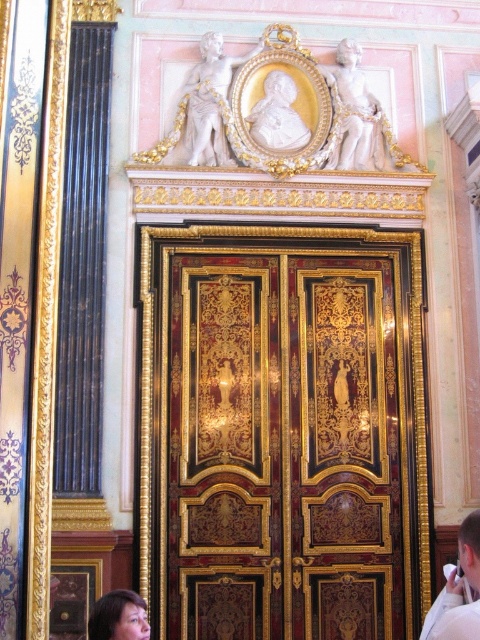
Question: Which point is closer to the camera?

Choices:
 (A) white matte shirt at lower right
 (B) glossy wood door at center
 (C) smooth skin face at lower left
 (D) white satin robe at center

Answer: (D)

Question: Is white matte shirt at lower right to the left of white satin robe at center from the viewer's perspective?

Choices:
 (A) no
 (B) yes

Answer: (A)

Question: Which of the following is the closest to the observer?

Choices:
 (A) glossy wood door at center
 (B) white matte shirt at lower right
 (C) white satin robe at center

Answer: (C)

Question: Does glossy wood door at center have a lesser width compared to smooth skin face at lower left?

Choices:
 (A) no
 (B) yes

Answer: (A)

Question: Which object appears farthest from the camera in this image?

Choices:
 (A) glossy wood door at center
 (B) smooth skin face at lower left
 (C) white satin robe at center

Answer: (A)

Question: Is glossy wood door at center to the right of smooth skin face at lower left from the viewer's perspective?

Choices:
 (A) no
 (B) yes

Answer: (B)